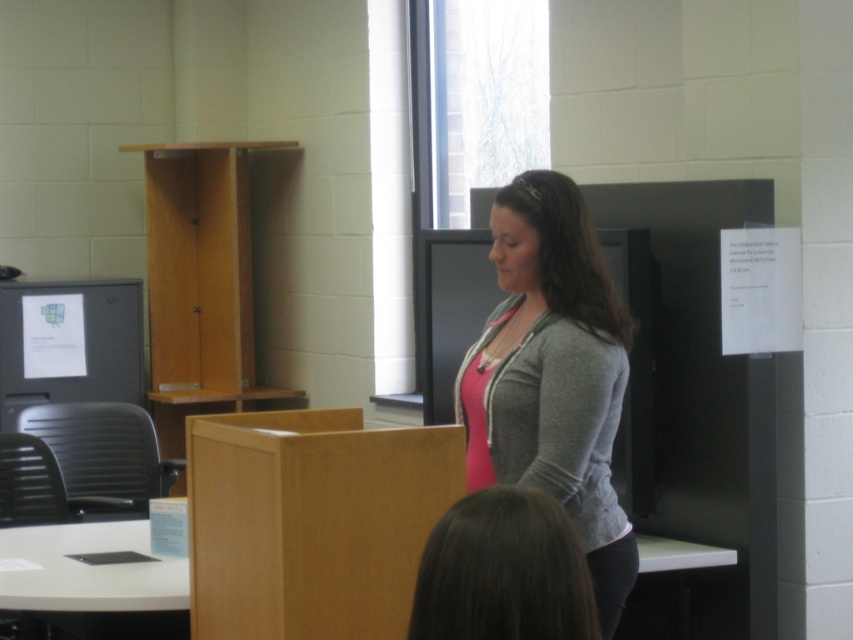
Question: Is gray fleece jacket at center closer to the viewer compared to matte black monitor at left?

Choices:
 (A) no
 (B) yes

Answer: (B)

Question: Which object is positioned farthest from the brown smooth hair at lower center?

Choices:
 (A) gray fleece jacket at center
 (B) matte black monitor at left

Answer: (B)

Question: Can you confirm if gray fleece jacket at center is smaller than brown smooth hair at lower center?

Choices:
 (A) yes
 (B) no

Answer: (B)

Question: Does gray fleece jacket at center have a lesser width compared to brown smooth hair at lower center?

Choices:
 (A) no
 (B) yes

Answer: (A)

Question: Which object is the farthest from the gray fleece jacket at center?

Choices:
 (A) brown smooth hair at lower center
 (B) matte black monitor at left

Answer: (B)

Question: Which point is closer to the camera?

Choices:
 (A) (430, 552)
 (B) (32, 381)
 (C) (560, 442)

Answer: (A)